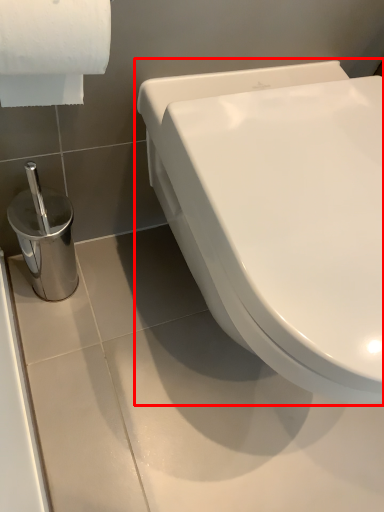
Question: From the image's perspective, where is toilet (annotated by the red box) located relative to toilet paper?

Choices:
 (A) below
 (B) above

Answer: (A)